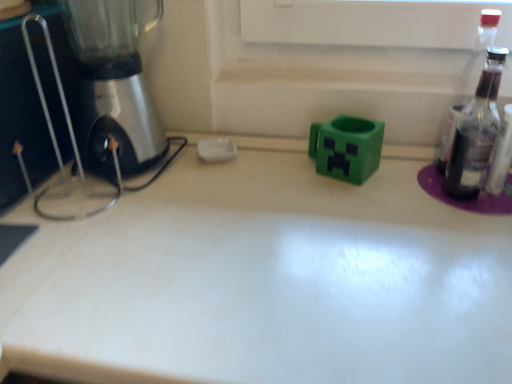
Where is `free space above white glossy countertop at center (from a real-world perspective)`? free space above white glossy countertop at center (from a real-world perspective) is located at coordinates (318, 252).